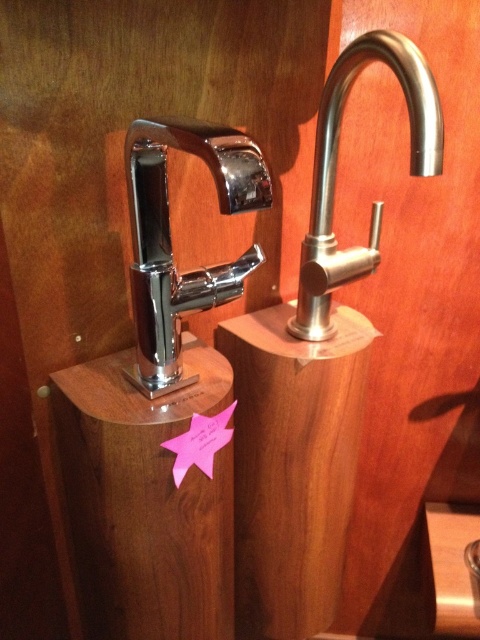
Question: Which of these objects is positioned closest to the wooden pedestal at center?

Choices:
 (A) polished stainless steel faucet at upper right
 (B) polished chrome faucet at center

Answer: (B)

Question: Can you confirm if polished chrome faucet at center is positioned below polished stainless steel faucet at upper right?

Choices:
 (A) yes
 (B) no

Answer: (A)

Question: Can you confirm if wooden pedestal at center is smaller than polished stainless steel faucet at upper right?

Choices:
 (A) yes
 (B) no

Answer: (B)

Question: Which of the following is the farthest from the observer?

Choices:
 (A) (165, 125)
 (B) (442, 157)
 (C) (180, 392)

Answer: (C)

Question: Does polished chrome faucet at center lie in front of polished stainless steel faucet at upper right?

Choices:
 (A) yes
 (B) no

Answer: (A)

Question: Which point is closer to the camera?

Choices:
 (A) (87, 531)
 (B) (326, 248)

Answer: (A)